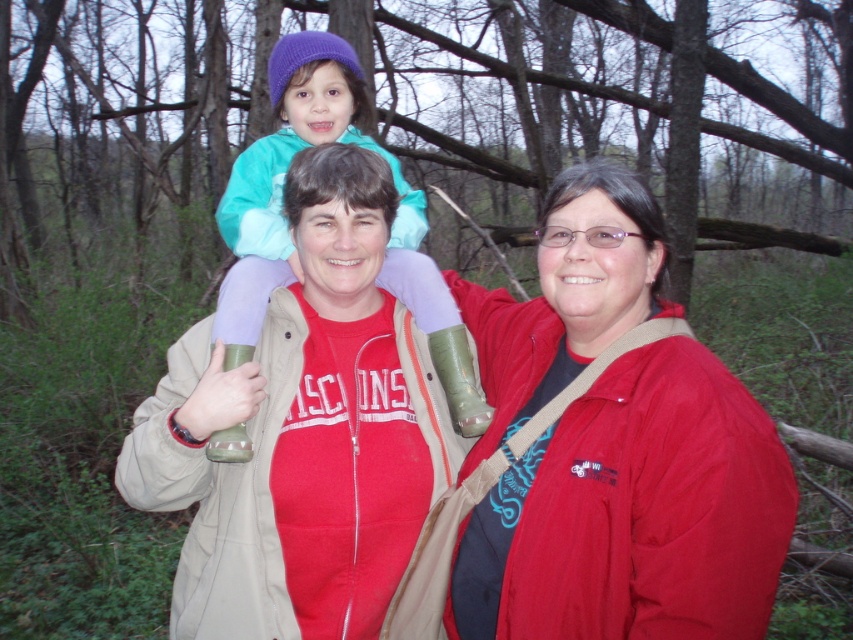
Is matte red jacket at center further to camera compared to matte green rubber boots at center?

No.

Is matte red jacket at center in front of matte green rubber boots at center?

Yes, it is.

Identify the location of matte red jacket at center. (634, 513).

Where is `matte red jacket at center`? matte red jacket at center is located at coordinates (634, 513).

Who is taller, matte red jacket at center or turquoise fleece jacket at center?

Standing taller between the two is turquoise fleece jacket at center.

Is matte red jacket at center taller than turquoise fleece jacket at center?

Incorrect, matte red jacket at center's height is not larger of turquoise fleece jacket at center's.

Identify the location of matte red jacket at center. (634, 513).

Can you confirm if matte green rubber boots at center is positioned above turquoise fleece jacket at center?

No.

Is matte green rubber boots at center to the right of turquoise fleece jacket at center from the viewer's perspective?

Indeed, matte green rubber boots at center is positioned on the right side of turquoise fleece jacket at center.

Between point (341, 577) and point (286, 67), which one is positioned behind?

The point (286, 67) is more distant.

At what (x,y) coordinates should I click in order to perform the action: click on matte green rubber boots at center. Please return your answer as a coordinate pair (x, y). The image size is (853, 640). Looking at the image, I should click on (302, 433).